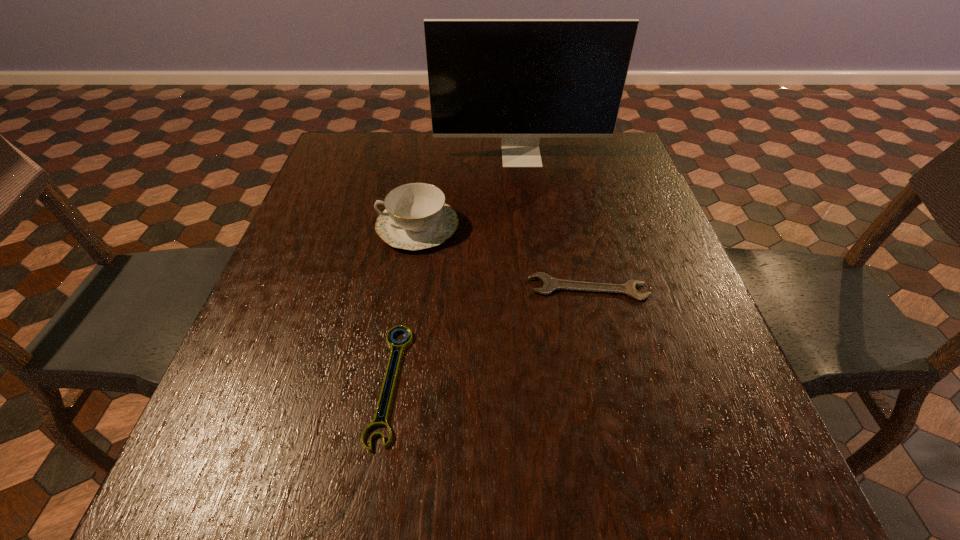
Locate an element on the screen. Image resolution: width=960 pixels, height=540 pixels. vacant space situated on the handle side of the second farthest object is located at coordinates (336, 227).

You are a GUI agent. You are given a task and a screenshot of the screen. Output one action in this format:
    pyautogui.click(x=<x>, y=<y>)
    Task: Click on the blank space located on the handle side of the second farthest object
    
    Given the screenshot: What is the action you would take?
    pyautogui.click(x=340, y=227)

Image resolution: width=960 pixels, height=540 pixels. I want to click on vacant region located on the front of the third farthest object, so click(636, 494).

Locate an element on the screen. free region located on the back of the shorter wrench is located at coordinates (405, 287).

Locate an element on the screen. This screenshot has height=540, width=960. object that is at the far edge is located at coordinates (520, 80).

I want to click on monitor situated at the right edge, so click(520, 80).

At what (x,y) coordinates should I click in order to perform the action: click on wrench situated at the right edge. Please return your answer as a coordinate pair (x, y). The image size is (960, 540). Looking at the image, I should click on (550, 284).

Where is `object at the far right corner`? object at the far right corner is located at coordinates (520, 80).

The height and width of the screenshot is (540, 960). I want to click on vacant space at the far edge, so click(x=449, y=153).

Locate an element on the screen. The image size is (960, 540). vacant space at the left edge of the desktop is located at coordinates (305, 284).